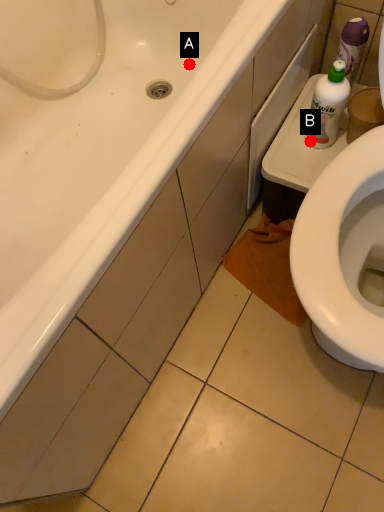
Question: Two points are circled on the image, labeled by A and B beside each circle. Which point appears farthest from the camera in this image?

Choices:
 (A) A is further
 (B) B is further

Answer: (A)